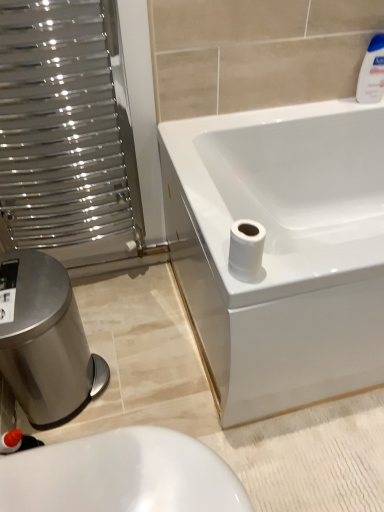
This screenshot has width=384, height=512. Find the location of `brushed metal bidet at lower left`. brushed metal bidet at lower left is located at coordinates (47, 344).

At what (x,y) coordinates should I click in order to perform the action: click on metallic silver radiator at left. Please return your answer as a coordinate pair (x, y). This screenshot has width=384, height=512. Looking at the image, I should click on (64, 136).

What is the approximate height of white glossy bottle at upper right?

The height of white glossy bottle at upper right is 7.86 inches.

This screenshot has width=384, height=512. I want to click on white glossy bathtub at upper right, so click(282, 249).

Based on the photo, considering the relative positions of brushed metal bidet at lower left and metallic silver radiator at left in the image provided, is brushed metal bidet at lower left to the left of metallic silver radiator at left from the viewer's perspective?

No, brushed metal bidet at lower left is not to the left of metallic silver radiator at left.

Is point (56, 377) closer or farther from the camera than point (112, 184)?

Point (56, 377) appears to be closer to the viewer than point (112, 184).

From a real-world perspective, is brushed metal bidet at lower left positioned above or below metallic silver radiator at left?

brushed metal bidet at lower left is situated lower than metallic silver radiator at left in the real world.

Is brushed metal bidet at lower left directly adjacent to metallic silver radiator at left?

brushed metal bidet at lower left is not next to metallic silver radiator at left, and they're not touching.

From the picture: Which is behind, metallic silver radiator at left or white matte toilet paper at lower right?

metallic silver radiator at left.

Is metallic silver radiator at left wider than white matte toilet paper at lower right?

Yes.

Is white matte toilet paper at lower right inside metallic silver radiator at left?

Definitely not — white matte toilet paper at lower right is not inside metallic silver radiator at left.

Is point (30, 415) farther from viewer compared to point (289, 180)?

No, it is in front of (289, 180).

In terms of height, does brushed metal bidet at lower left look taller or shorter compared to white glossy bathtub at upper right?

Considering their sizes, brushed metal bidet at lower left has less height than white glossy bathtub at upper right.

Where is `bathtub that appears above the brushed metal bidet at lower left (from the image's perspective)`? This screenshot has width=384, height=512. bathtub that appears above the brushed metal bidet at lower left (from the image's perspective) is located at coordinates (282, 249).

From the image's perspective, would you say white glossy bottle at upper right is shown under white glossy bathtub at upper right?

No.

Where is `bathtub in front of the white glossy bottle at upper right`? This screenshot has height=512, width=384. bathtub in front of the white glossy bottle at upper right is located at coordinates (282, 249).

From a real-world perspective, is white glossy bottle at upper right above or below white glossy bathtub at upper right?

white glossy bottle at upper right is situated higher than white glossy bathtub at upper right in the real world.

Would you say white glossy toilet at lower left contains brushed metal bidet at lower left?

No, brushed metal bidet at lower left is not surrounded by white glossy toilet at lower left.

Identify the location of bidet below the white glossy toilet at lower left (from a real-world perspective). (47, 344).

Can you confirm if white glossy toilet at lower left is taller than brushed metal bidet at lower left?

Incorrect, the height of white glossy toilet at lower left is not larger of that of brushed metal bidet at lower left.

Considering the relative positions of white glossy toilet at lower left and brushed metal bidet at lower left in the image provided, is white glossy toilet at lower left to the right of brushed metal bidet at lower left from the viewer's perspective?

Correct, you'll find white glossy toilet at lower left to the right of brushed metal bidet at lower left.

I want to click on cleaning product lying on the right of brushed metal bidet at lower left, so click(372, 72).

Is brushed metal bidet at lower left at the back of white glossy bottle at upper right?

white glossy bottle at upper right does not have its back to brushed metal bidet at lower left.

Is white glossy bottle at upper right thinner than brushed metal bidet at lower left?

Yes, white glossy bottle at upper right is thinner than brushed metal bidet at lower left.

Are white glossy bottle at upper right and brushed metal bidet at lower left beside each other?

They are not placed beside each other.

Is white matte toilet paper at lower right placed right next to brushed metal bidet at lower left?

No, white matte toilet paper at lower right is not making contact with brushed metal bidet at lower left.

Does white matte toilet paper at lower right have a greater width compared to brushed metal bidet at lower left?

No, white matte toilet paper at lower right is not wider than brushed metal bidet at lower left.

Considering the positions of objects white matte toilet paper at lower right and brushed metal bidet at lower left in the image provided, who is in front, white matte toilet paper at lower right or brushed metal bidet at lower left?

white matte toilet paper at lower right is in front.

I want to click on screen door on the left of the brushed metal bidet at lower left, so click(64, 136).

Find the location of a particular element. This screenshot has width=384, height=512. screen door beneath the white matte toilet paper at lower right (from a real-world perspective) is located at coordinates (64, 136).

Looking at this image, which object lies further to the anchor point white glossy bathtub at upper right, brushed metal bidet at lower left or white matte toilet paper at lower right?

brushed metal bidet at lower left.

Looking at the image, which one is located further to white glossy bathtub at upper right, white glossy toilet at lower left or metallic silver radiator at left?

The object further to white glossy bathtub at upper right is white glossy toilet at lower left.

Considering their positions, is white glossy bottle at upper right positioned further to white glossy toilet at lower left than white matte toilet paper at lower right?

Among the two, white glossy bottle at upper right is located further to white glossy toilet at lower left.

Looking at the image, which one is located further to metallic silver radiator at left, white glossy toilet at lower left or white glossy bathtub at upper right?

Based on the image, white glossy toilet at lower left appears to be further to metallic silver radiator at left.

From the image, which object appears to be farther from white glossy toilet at lower left, metallic silver radiator at left or brushed metal bidet at lower left?

Among the two, metallic silver radiator at left is located further to white glossy toilet at lower left.

From the image, which object appears to be nearer to white glossy toilet at lower left, white glossy bottle at upper right or brushed metal bidet at lower left?

brushed metal bidet at lower left is positioned closer to the anchor white glossy toilet at lower left.

Considering their positions, is white glossy bathtub at upper right positioned closer to brushed metal bidet at lower left than white glossy toilet at lower left?

white glossy toilet at lower left lies closer to brushed metal bidet at lower left than the other object.

From the image, which object appears to be farther from white glossy bottle at upper right, white glossy toilet at lower left or brushed metal bidet at lower left?

Based on the image, white glossy toilet at lower left appears to be further to white glossy bottle at upper right.

Locate an element on the screen. Image resolution: width=384 pixels, height=512 pixels. bathtub between white glossy bottle at upper right and white glossy toilet at lower left from top to bottom is located at coordinates (282, 249).

The width and height of the screenshot is (384, 512). In order to click on toilet paper situated between brushed metal bidet at lower left and white glossy bottle at upper right from left to right in this screenshot , I will do `click(246, 249)`.

I want to click on bidet situated between metallic silver radiator at left and white matte toilet paper at lower right from left to right, so click(47, 344).

You are a GUI agent. You are given a task and a screenshot of the screen. Output one action in this format:
    pyautogui.click(x=<x>, y=<y>)
    Task: Click on the screen door between white glossy bottle at upper right and white glossy toilet at lower left in the up-down direction
    The height and width of the screenshot is (512, 384).
    Given the screenshot: What is the action you would take?
    pyautogui.click(x=64, y=136)